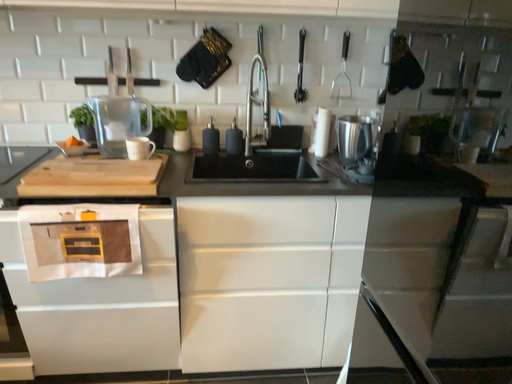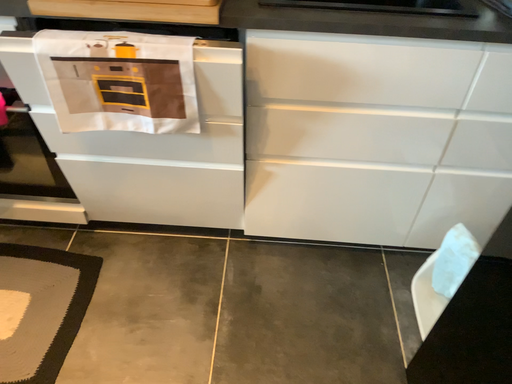
Question: Which way did the camera rotate in the video?

Choices:
 (A) rotated upward
 (B) rotated downward

Answer: (B)